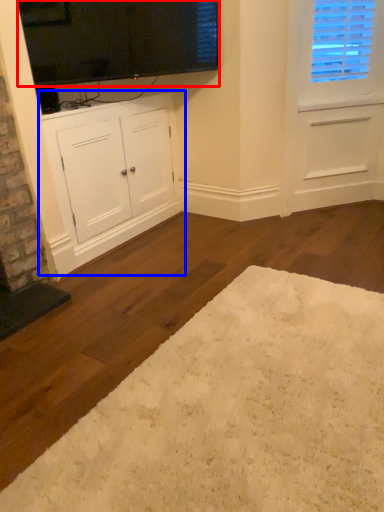
Question: Which of the following is the farthest to the observer, window screen (highlighted by a red box) or cabinetry (highlighted by a blue box)?

Choices:
 (A) window screen
 (B) cabinetry

Answer: (B)